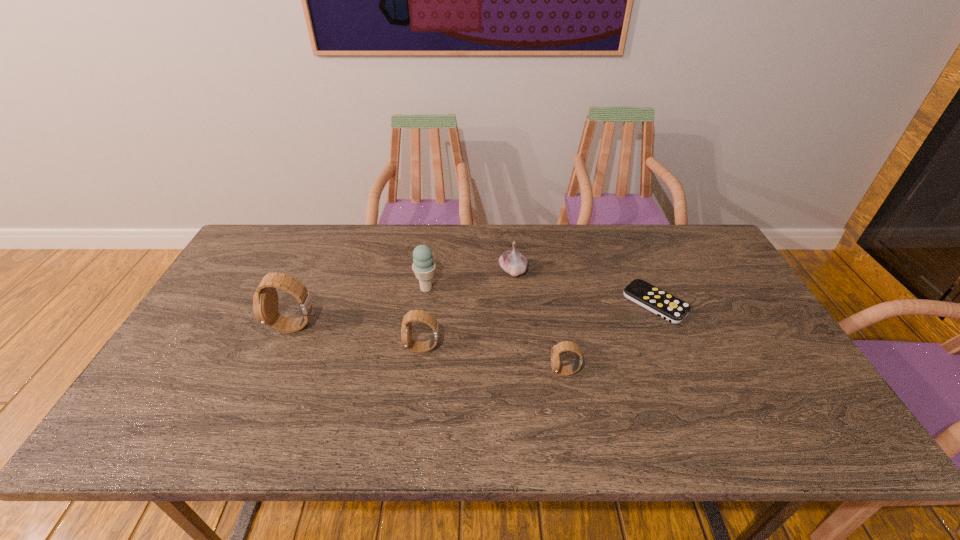
Where is `vacant space located on the face of the leftmost watch`? The image size is (960, 540). vacant space located on the face of the leftmost watch is located at coordinates (200, 327).

I want to click on vacant area situated 0.200m on the face of the leftmost watch, so click(200, 327).

This screenshot has height=540, width=960. I want to click on vacant space located 0.150m on the face of the leftmost watch, so click(218, 327).

Image resolution: width=960 pixels, height=540 pixels. In order to click on free location located on the face of the second tallest watch in this screenshot , I will do `click(311, 348)`.

I want to click on free space located on the face of the second tallest watch, so click(342, 348).

At what (x,y) coordinates should I click in order to perform the action: click on free spot located on the face of the second tallest watch. Please return your answer as a coordinate pair (x, y). The width and height of the screenshot is (960, 540). Looking at the image, I should click on (330, 348).

Find the location of `free space located 0.150m on the face of the nearest watch`. free space located 0.150m on the face of the nearest watch is located at coordinates (491, 372).

The width and height of the screenshot is (960, 540). What are the coordinates of `vacant space located on the face of the nearest watch` in the screenshot? It's located at (450, 372).

Identify the location of free space located 0.220m on the face of the nearest watch. (462, 372).

Where is `blank space located on the right of the rightmost object`? blank space located on the right of the rightmost object is located at coordinates (754, 303).